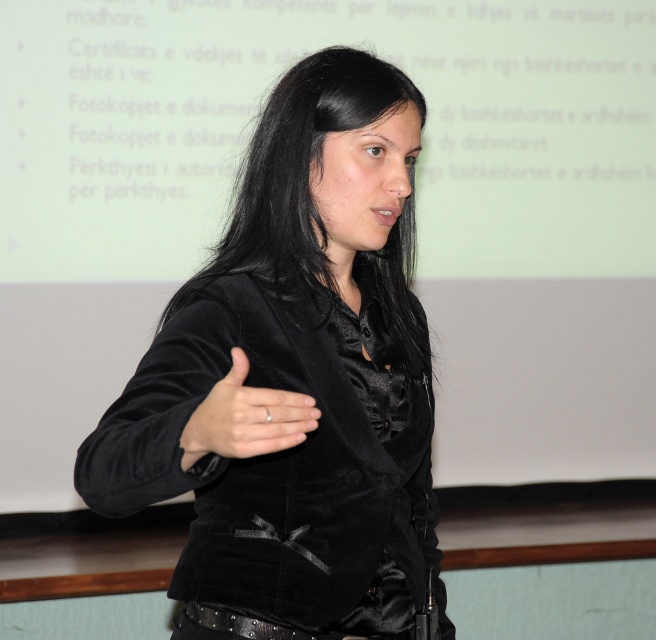
Question: In this image, where is black velvet hair at center located relative to satin black hand at center?

Choices:
 (A) above
 (B) below

Answer: (A)

Question: Which point is closer to the camera?

Choices:
 (A) (314, 112)
 (B) (216, 436)
 (C) (297, 426)

Answer: (C)

Question: Can you confirm if black velvet hair at center is positioned to the left of satin black hand at center?

Choices:
 (A) yes
 (B) no

Answer: (B)

Question: Considering the real-world distances, which object is closest to the satin black hand at center?

Choices:
 (A) black velvet hair at center
 (B) velvet black jacket at center

Answer: (B)

Question: Can you confirm if velvet black jacket at center is positioned above black velvet hair at center?

Choices:
 (A) no
 (B) yes

Answer: (A)

Question: Which point is farther from the camera taking this photo?

Choices:
 (A) (328, 348)
 (B) (256, 241)

Answer: (B)